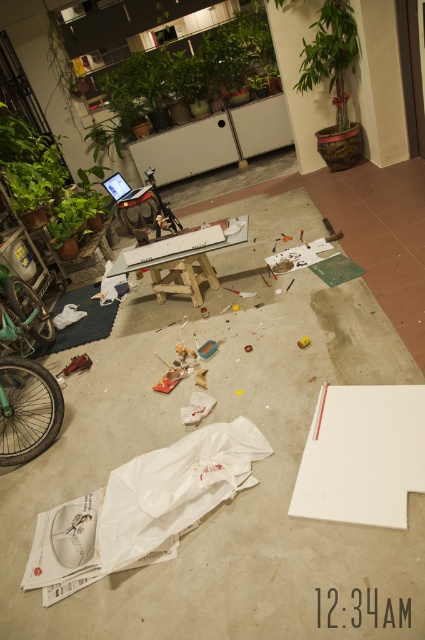
Question: Which point is closer to the camera?

Choices:
 (A) (314, 54)
 (B) (36, 189)

Answer: (B)

Question: From the image, what is the correct spatial relationship of wooden table at center in relation to white matte paper at center?

Choices:
 (A) left
 (B) right

Answer: (A)

Question: Estimate the real-world distances between objects in this image. Which object is closer to the green matte plant at upper center?

Choices:
 (A) matte black laptop at center
 (B) green leafy plant at upper center
 (C) green leafy plant at upper left
 (D) white matte cement at center

Answer: (B)

Question: Where is green leafy plant at upper left located in relation to wooden table at center in the image?

Choices:
 (A) right
 (B) left

Answer: (B)

Question: Does green matte plant at upper center have a lesser width compared to matte black laptop at center?

Choices:
 (A) yes
 (B) no

Answer: (B)

Question: Which of the following is the farthest from the observer?

Choices:
 (A) (280, 253)
 (B) (319, 52)
 (C) (124, 198)
 (D) (8, 156)

Answer: (D)